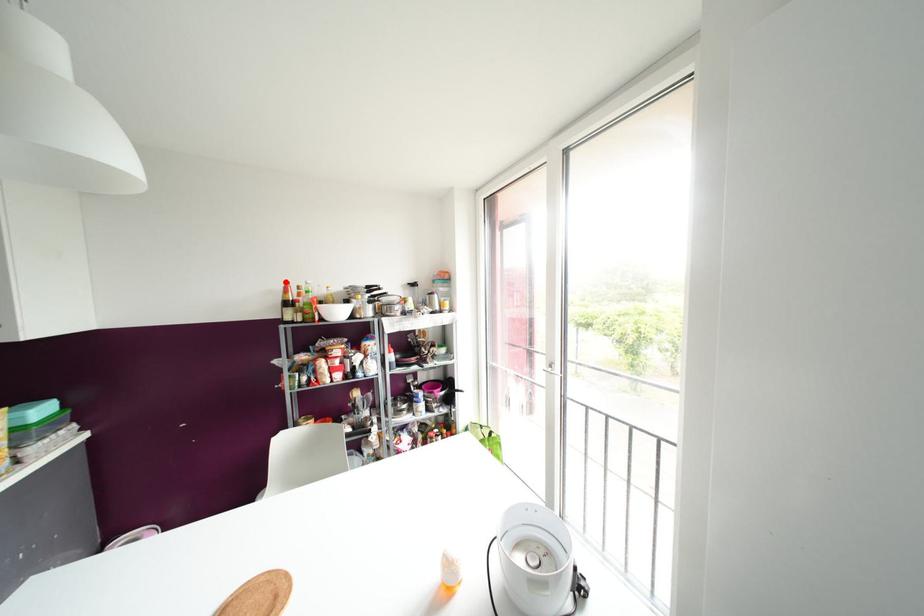
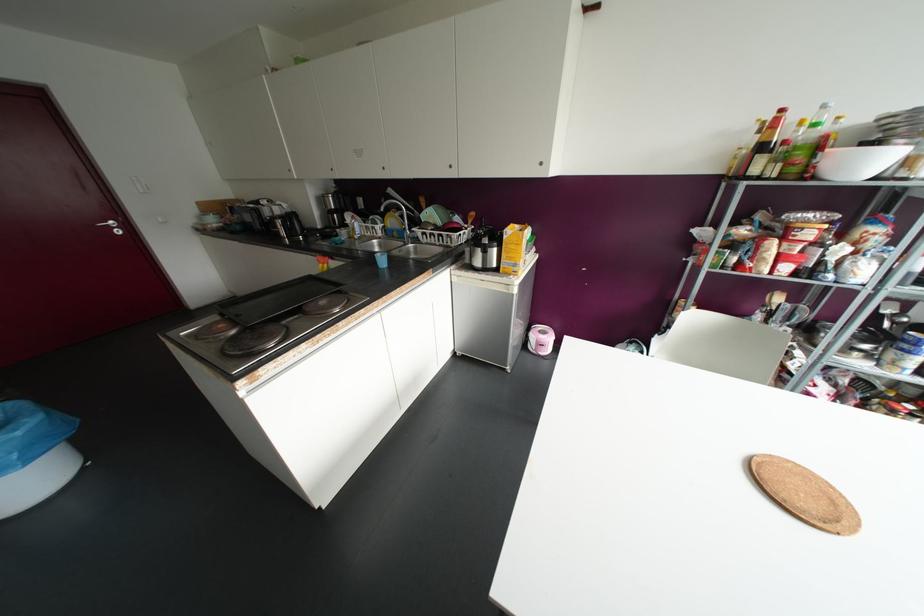
Where in the second image is the point corresponding to the highlighted location from the first image?

(781, 110)